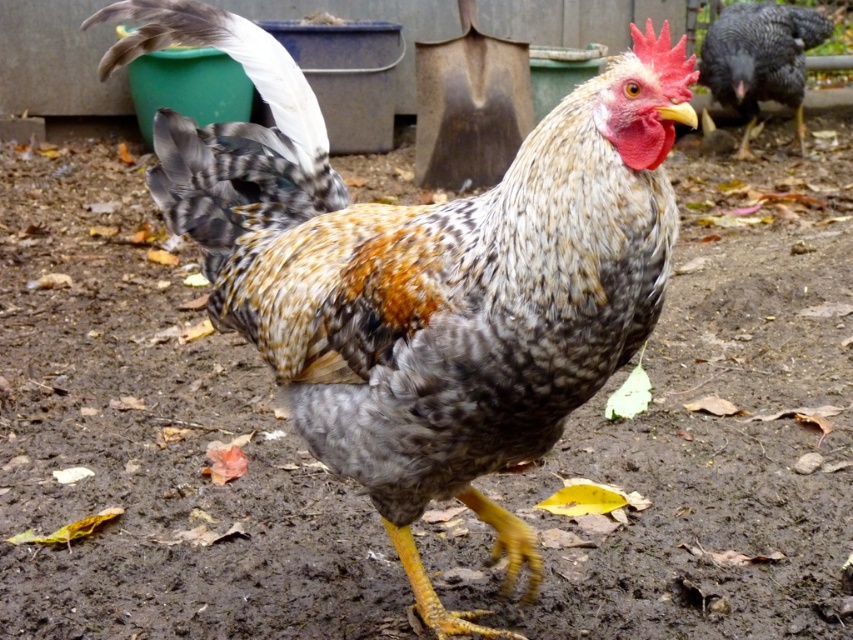
Question: Observing the image, what is the correct spatial positioning of speckled feathered rooster at center in reference to speckled feathered rooster at upper right?

Choices:
 (A) below
 (B) above

Answer: (A)

Question: Which point is farther to the camera?

Choices:
 (A) speckled feathered rooster at upper right
 (B) speckled feathered rooster at center

Answer: (A)

Question: Which of the following is the closest to the observer?

Choices:
 (A) (445, 356)
 (B) (737, 70)

Answer: (A)

Question: Is speckled feathered rooster at center positioned before speckled feathered rooster at upper right?

Choices:
 (A) yes
 (B) no

Answer: (A)

Question: Which of the following is the closest to the observer?

Choices:
 (A) speckled feathered rooster at upper right
 (B) speckled feathered rooster at center

Answer: (B)

Question: Does speckled feathered rooster at center appear on the left side of speckled feathered rooster at upper right?

Choices:
 (A) yes
 (B) no

Answer: (A)